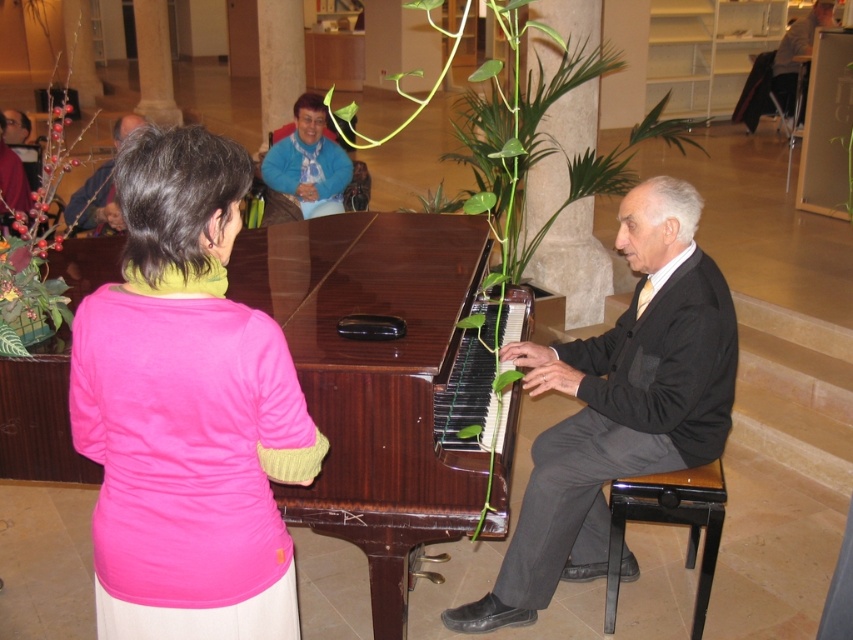
Question: Is matte black piano at center below light brown wood chair at upper right?

Choices:
 (A) no
 (B) yes

Answer: (B)

Question: Which point appears farthest from the camera in this image?

Choices:
 (A) (715, 426)
 (B) (787, 77)
 (C) (305, 156)

Answer: (B)

Question: Is dark gray suit at right below green leafy plant at center?

Choices:
 (A) no
 (B) yes

Answer: (B)

Question: Which point is closer to the camera?

Choices:
 (A) matte black piano at center
 (B) blue soft scarf at upper center

Answer: (A)

Question: Estimate the real-world distances between objects in this image. Which object is closer to the green leafy plant at center?

Choices:
 (A) blue soft scarf at upper center
 (B) matte black piano at center
 (C) dark gray suit at right
 (D) pink fabric shirt at upper left

Answer: (A)

Question: Does pink fabric shirt at upper left have a greater width compared to black glossy stool at lower right?

Choices:
 (A) yes
 (B) no

Answer: (A)